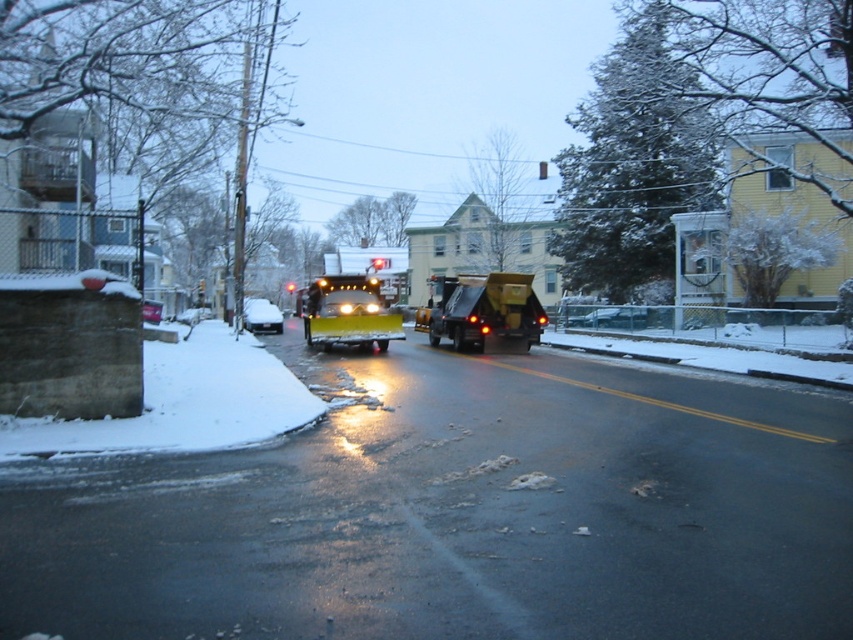
Is point (247, 307) closer to camera compared to point (151, 308)?

That is False.

Where is `white matte car at center`? The image size is (853, 640). white matte car at center is located at coordinates (260, 316).

Is metallic yellow garbage truck at center above white matte car at center?

Yes.

Between point (456, 333) and point (273, 310), which one is positioned behind?

Positioned behind is point (273, 310).

I want to click on metallic yellow garbage truck at center, so click(483, 310).

Is yellow rubber snowplow at center wider than metallic silver sedan at center?

Yes, yellow rubber snowplow at center is wider than metallic silver sedan at center.

From the picture: Can you confirm if yellow rubber snowplow at center is positioned above metallic silver sedan at center?

Indeed, yellow rubber snowplow at center is positioned over metallic silver sedan at center.

The height and width of the screenshot is (640, 853). I want to click on yellow rubber snowplow at center, so coord(355,300).